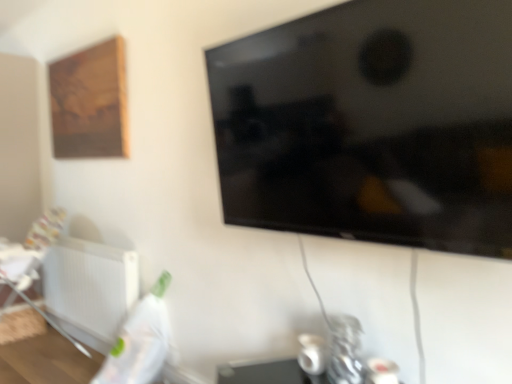
Question: Considering their positions, is white plastic radiator at lower left located in front of or behind wooden picture frame at upper left?

Choices:
 (A) behind
 (B) front

Answer: (B)

Question: In terms of size, does white plastic radiator at lower left appear bigger or smaller than wooden picture frame at upper left?

Choices:
 (A) small
 (B) big

Answer: (B)

Question: Which of these objects is positioned farthest from the black glossy tv at upper center?

Choices:
 (A) white plastic radiator at lower left
 (B) wooden picture frame at upper left

Answer: (A)

Question: Estimate the real-world distances between objects in this image. Which object is farther from the wooden picture frame at upper left?

Choices:
 (A) white plastic radiator at lower left
 (B) black glossy tv at upper center

Answer: (B)